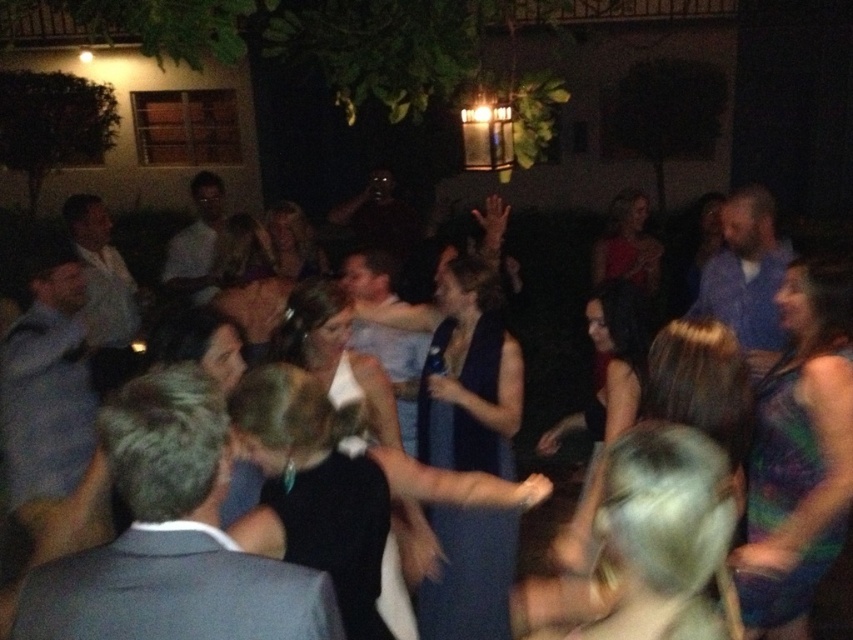
You are a photographer at the event and want to capture a photo of both the dark blue satin dress at center and the blue dress at center. Which dress should you focus on first to ensure both are in the frame?

You should focus on the dark blue satin dress at center first because it is closer to you than the blue dress at center, ensuring both will be in the frame when properly focused.

You are at the party and want to take a photo of both the green satin dress at lower right and the blue dress at center. Since the camera can only focus on one subject at a time, which dress should you focus on first to ensure the other is still in the frame?

You should focus on the green satin dress at lower right first because it is closer to the viewer than the blue dress at center, so keeping it in focus will still allow the blue dress at center to be visible in the background.

You are a photographer at the event and want to capture both the dark blue satin dress at center and the green satin dress at lower right in a single shot. Since the camera can only focus on one subject at a time, which dress should you choose to ensure the other is still somewhat visible in the background?

The dark blue satin dress at center is thinner than the green satin dress at lower right, so focusing on the green satin dress at lower right would allow the thinner dark blue satin dress at center to still be somewhat visible in the background.